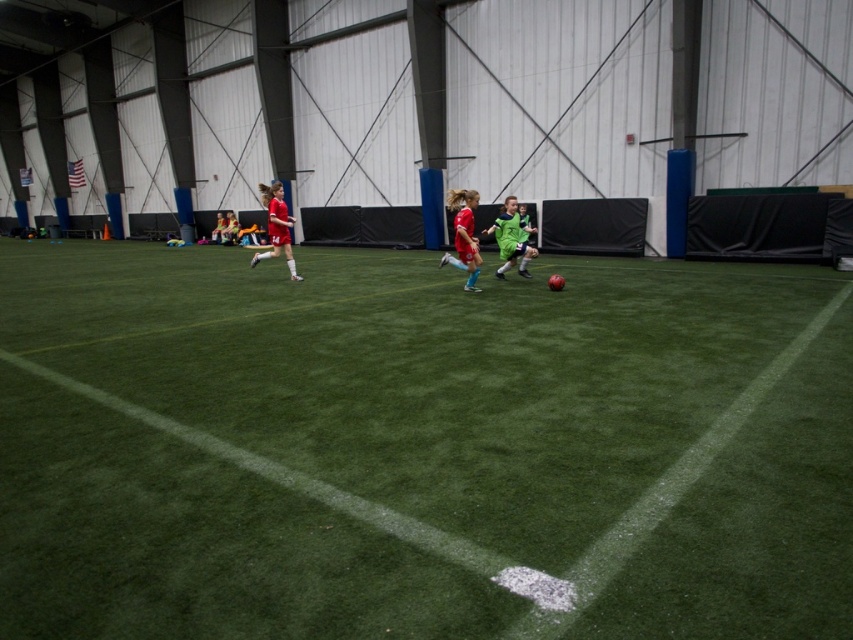
Question: Is red jersey at center smaller than matte red soccer jersey at center?

Choices:
 (A) no
 (B) yes

Answer: (B)

Question: Is green artificial turf at center positioned behind green matte soccer player at center?

Choices:
 (A) yes
 (B) no

Answer: (B)

Question: Which point appears farthest from the camera in this image?

Choices:
 (A) (521, 241)
 (B) (454, 260)
 (C) (445, 342)
 (D) (283, 205)

Answer: (D)

Question: Does red jersey at center come in front of matte red soccer jersey at center?

Choices:
 (A) yes
 (B) no

Answer: (A)

Question: Among these points, which one is nearest to the camera?

Choices:
 (A) (277, 236)
 (B) (444, 429)
 (C) (523, 256)

Answer: (B)

Question: Considering the real-world distances, which object is farthest from the green artificial turf at center?

Choices:
 (A) matte red soccer jersey at center
 (B) green matte soccer player at center

Answer: (A)